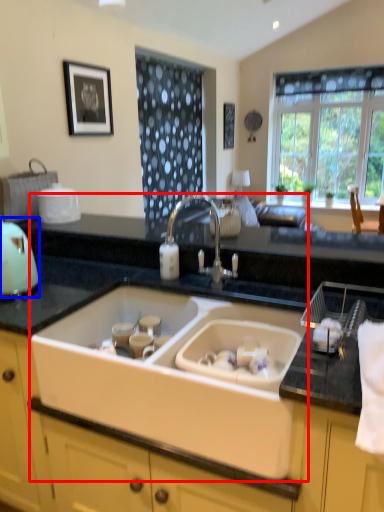
Question: Which point is closer to the camera, sink (highlighted by a red box) or appliance (highlighted by a blue box)?

Choices:
 (A) sink
 (B) appliance

Answer: (A)